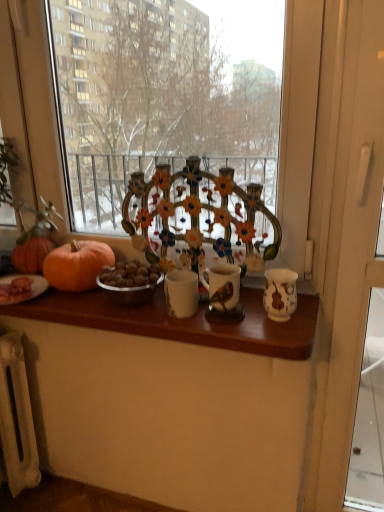
Locate an element on the screen. The height and width of the screenshot is (512, 384). vacant space in front of matte ceramic candle holder at center is located at coordinates (238, 334).